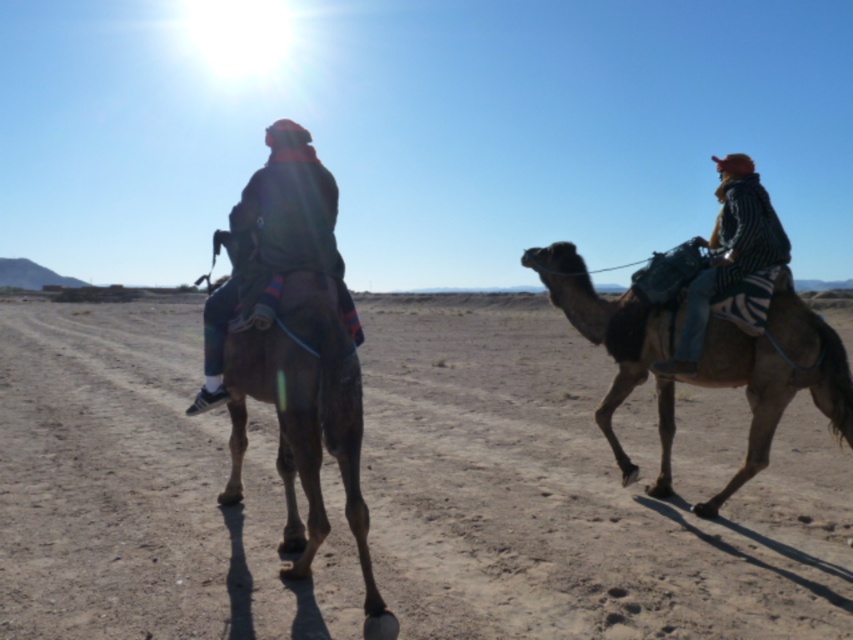
You are a photographer trying to capture the brown rough camel at left in your shot. The camera you are using has a rectangular viewfinder with coordinates from 0 to 1 on both the x and y axes. The point at (306, 422) is part of the camel. Where should you position the camera to ensure the entire camel is within the viewfinder?

The point at (306, 422) is on the brown rough camel at left, so you should position the camera to include this point within the viewfinder to ensure the camel is captured.

You are a photographer trying to capture both camels in a single shot. Given that the brown fuzzy camel at right is positioned above the brown rough camel at left, will you need to adjust your camera angle to include both in the frame?

Yes, you need to adjust your camera angle because the brown fuzzy camel at right is above the brown rough camel at left, so tilting the camera downward slightly might help capture both in the frame.

You are a photographer planning to take a photo of the brown rough camel at left and the dark brown leather jacket at center. Which object should you focus on first if you want to capture both in sharp focus?

The brown rough camel at left is shorter than the dark brown leather jacket at center, so you should focus on the dark brown leather jacket at center first to ensure both are in sharp focus.